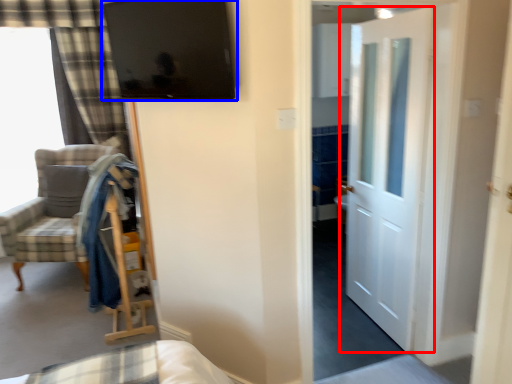
Question: Which of the following is the closest to the observer, door (highlighted by a red box) or window screen (highlighted by a blue box)?

Choices:
 (A) door
 (B) window screen

Answer: (B)